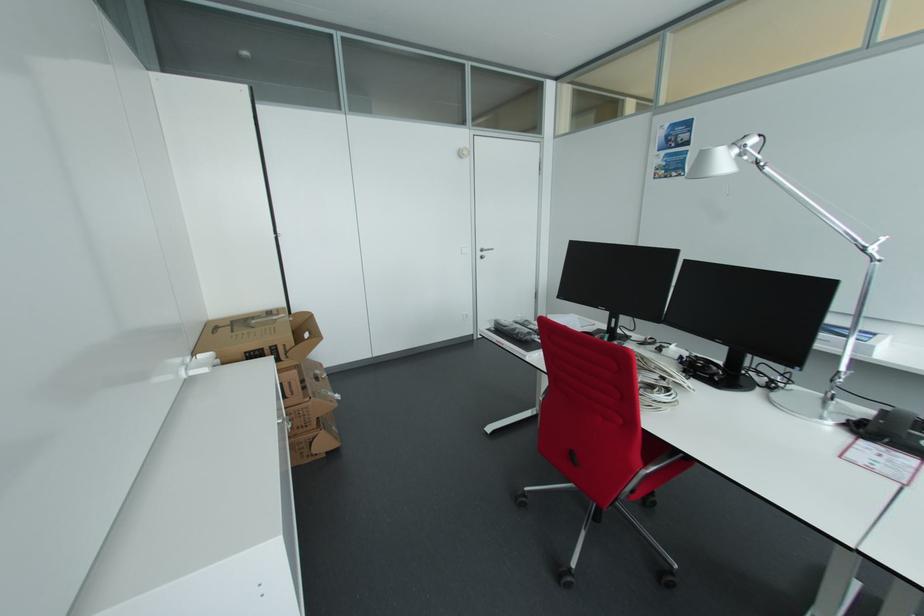
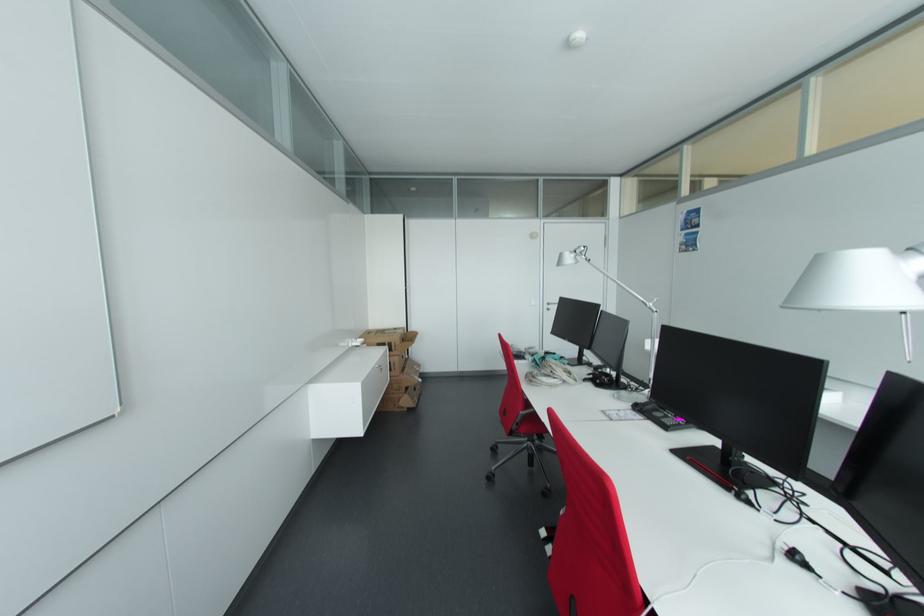
The point at (297, 314) is marked in the first image. Where is the corresponding point in the second image?

(412, 331)